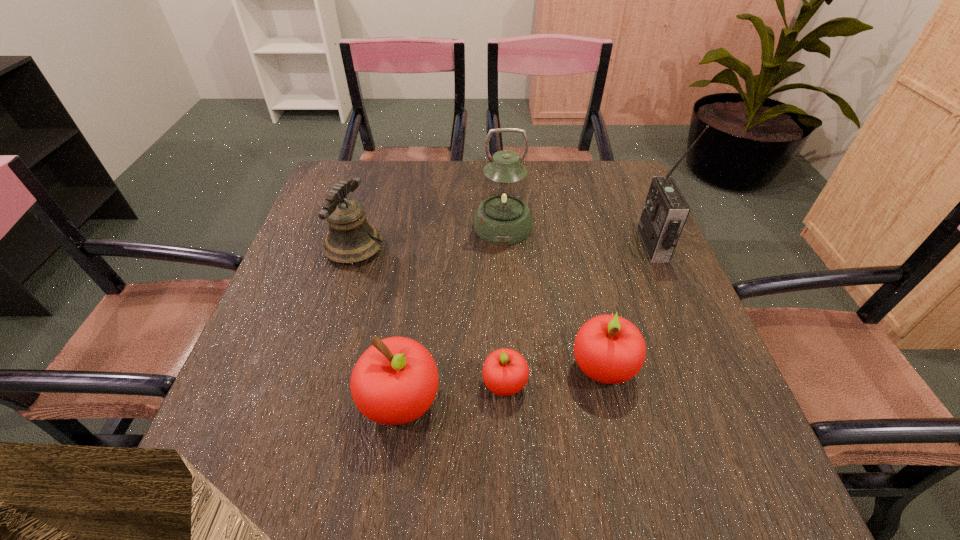
Locate an element on the screen. This screenshot has width=960, height=540. blank space that satisfies the following two spatial constraints: 1. on the front side of the fifth tallest object; 2. on the right side of the lantern is located at coordinates (512, 367).

Locate an element on the screen. Image resolution: width=960 pixels, height=540 pixels. vacant space that satisfies the following two spatial constraints: 1. on the front side of the second tallest apple; 2. on the left side of the lantern is located at coordinates (512, 367).

Find the location of a particular element. The height and width of the screenshot is (540, 960). vacant region that satisfies the following two spatial constraints: 1. on the back side of the second shortest apple; 2. on the right side of the second apple from right to left is located at coordinates (504, 367).

Where is `free location that satisfies the following two spatial constraints: 1. on the back side of the second object from left to right; 2. on the left side of the second apple from right to left`? free location that satisfies the following two spatial constraints: 1. on the back side of the second object from left to right; 2. on the left side of the second apple from right to left is located at coordinates (403, 384).